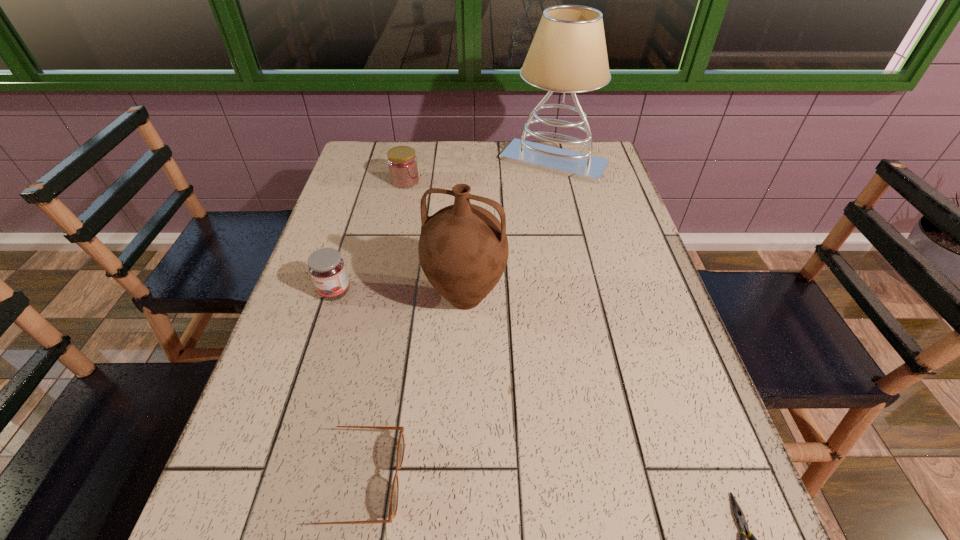
This screenshot has width=960, height=540. What are the coordinates of `vacant space that satisfies the following two spatial constraints: 1. on the back side of the leftmost object; 2. on the right side of the tallest object` in the screenshot? It's located at (376, 162).